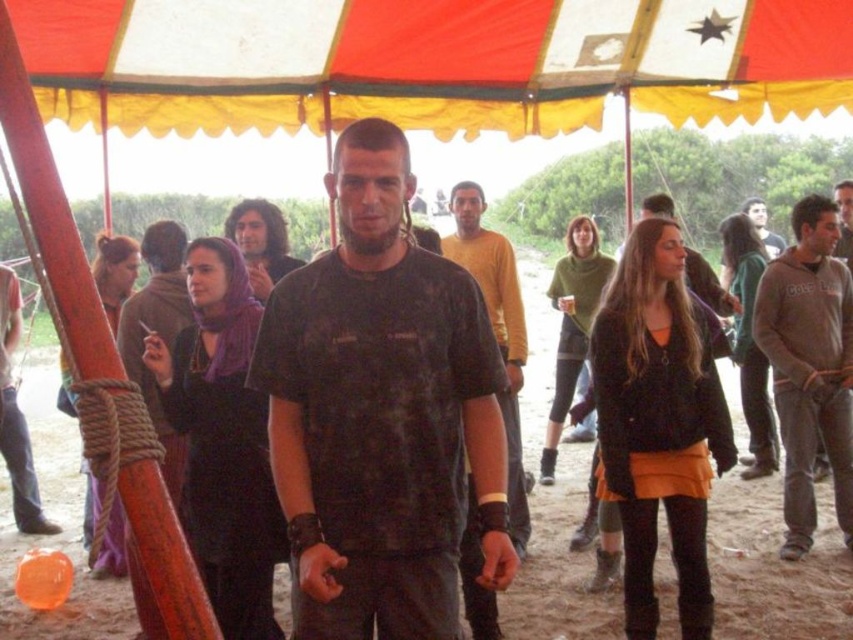
Which is above, gray fleece sweatshirt at right or matte black shirt at center?

gray fleece sweatshirt at right is above.

Is point (792, 408) positioned after point (15, 442)?

No, it is in front of (15, 442).

Locate an element on the screen. This screenshot has width=853, height=640. gray fleece sweatshirt at right is located at coordinates (809, 365).

Based on the photo, can you confirm if red and white striped canopy at upper center is positioned above matte black shirt at center?

Yes.

Does red and white striped canopy at upper center have a lesser height compared to matte black shirt at center?

Yes.

Identify the location of red and white striped canopy at upper center. (428, 61).

Does matte yellow shirt at center come behind matte black shirt at center?

No, it is not.

Does matte yellow shirt at center appear on the right side of matte black shirt at center?

Yes, matte yellow shirt at center is to the right of matte black shirt at center.

The image size is (853, 640). Identify the location of matte yellow shirt at center. (496, 326).